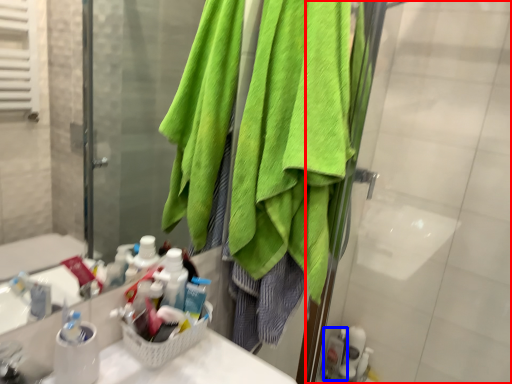
Question: Which of the following is the farthest to the observer, screen door (highlighted by a red box) or toiletry (highlighted by a blue box)?

Choices:
 (A) screen door
 (B) toiletry

Answer: (B)